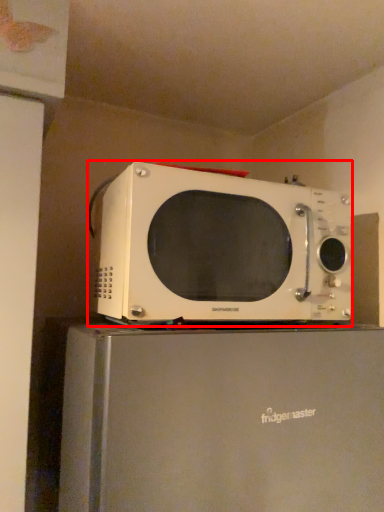
Question: From the image's perspective, where is microwave oven (annotated by the red box) located relative to appliance?

Choices:
 (A) below
 (B) above

Answer: (B)